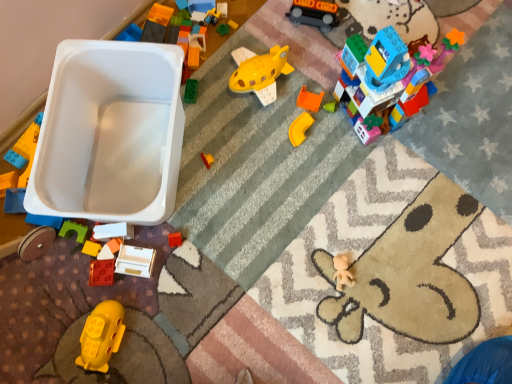
The width and height of the screenshot is (512, 384). What are the coordinates of `free space between yellow matte toy submarine at lower left, the 6th toy viewed from the right, and white plastic toy car at upper left` in the screenshot? It's located at (113, 283).